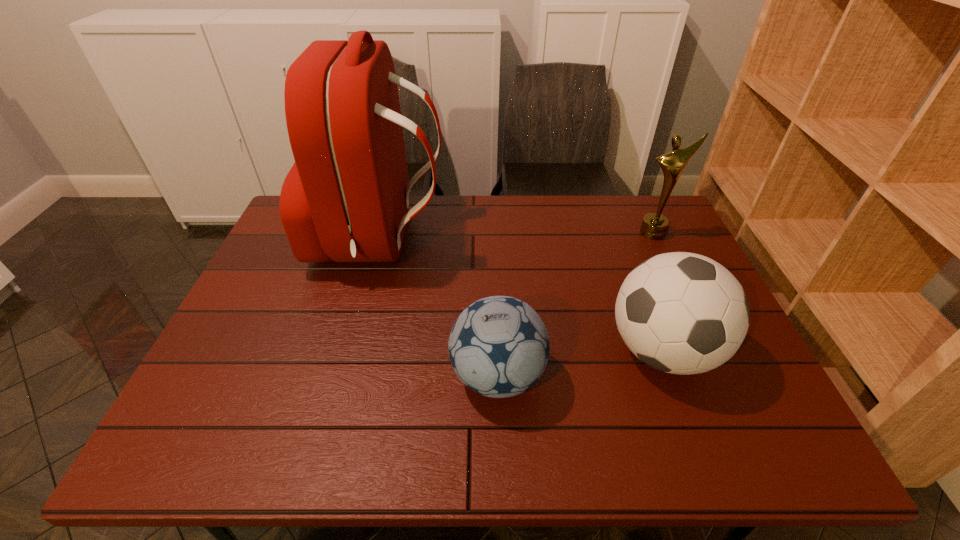
Locate an element on the screen. The width and height of the screenshot is (960, 540). free space between the award and the shorter soccer ball is located at coordinates (575, 304).

Where is `object that is the third closest to the award`? object that is the third closest to the award is located at coordinates (346, 198).

Choose which object is the third nearest neighbor to the shorter soccer ball. Please provide its 2D coordinates. Your answer should be formatted as a tuple, i.e. [(x, y)], where the tuple contains the x and y coordinates of a point satisfying the conditions above.

[(654, 226)]

Locate an element on the screen. The height and width of the screenshot is (540, 960). vacant space that satisfies the following two spatial constraints: 1. on the back side of the taller soccer ball; 2. on the strap side of the backpack is located at coordinates (621, 240).

Locate an element on the screen. Image resolution: width=960 pixels, height=540 pixels. free space that satisfies the following two spatial constraints: 1. on the front-facing side of the second tallest object; 2. on the strap side of the tallest object is located at coordinates (657, 240).

At what (x,y) coordinates should I click in order to perform the action: click on free spot that satisfies the following two spatial constraints: 1. on the front-facing side of the third shortest object; 2. on the side with brand of the shortest object. Please return your answer as a coordinate pair (x, y). Looking at the image, I should click on (721, 376).

This screenshot has height=540, width=960. What are the coordinates of `vacant region that satisfies the following two spatial constraints: 1. on the front side of the second shortest object; 2. on the side with brand of the second object from left to right` in the screenshot? It's located at (672, 376).

Image resolution: width=960 pixels, height=540 pixels. What are the coordinates of `vacant position in the image that satisfies the following two spatial constraints: 1. on the front-facing side of the second tallest object; 2. on the side with brand of the shorter soccer ball` in the screenshot? It's located at (721, 376).

This screenshot has width=960, height=540. In order to click on free spot that satisfies the following two spatial constraints: 1. on the front-facing side of the second tallest object; 2. on the side with brand of the shortest object in this screenshot , I will do `click(721, 376)`.